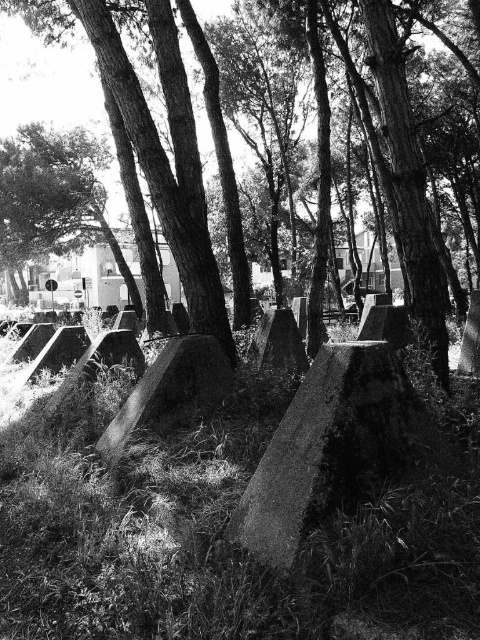
Question: Which of the following is the closest to the observer?

Choices:
 (A) smooth stone boulder at center
 (B) smooth bark tree at center

Answer: (A)

Question: Which point is closer to the camera?

Choices:
 (A) (396, 32)
 (B) (192, 342)

Answer: (B)

Question: Which object is closer to the camera taking this photo?

Choices:
 (A) smooth stone boulder at center
 (B) smooth bark tree at center

Answer: (A)

Question: Is smooth bark tree at center bigger than smooth stone boulder at center?

Choices:
 (A) no
 (B) yes

Answer: (B)

Question: Can you confirm if smooth bark tree at center is positioned below smooth stone boulder at center?

Choices:
 (A) yes
 (B) no

Answer: (B)

Question: Is smooth bark tree at center below smooth stone boulder at center?

Choices:
 (A) no
 (B) yes

Answer: (A)